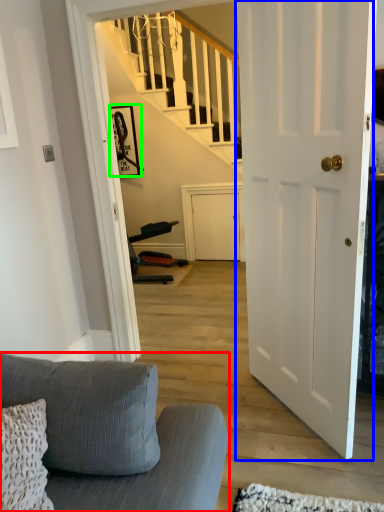
Question: Which object is the closest to the studio couch (highlighted by a red box)? Choose among these: door (highlighted by a blue box) or picture frame (highlighted by a green box).

Choices:
 (A) door
 (B) picture frame

Answer: (A)